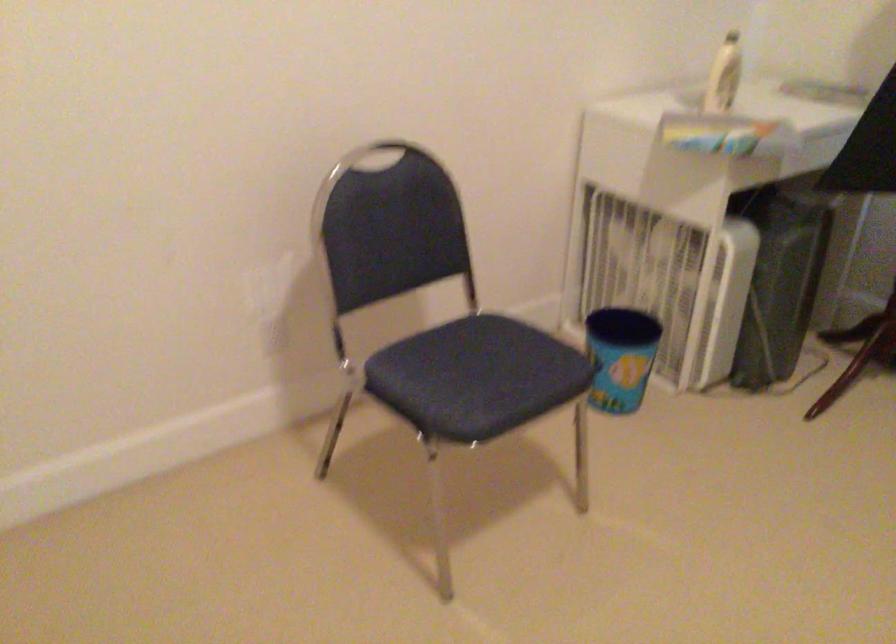
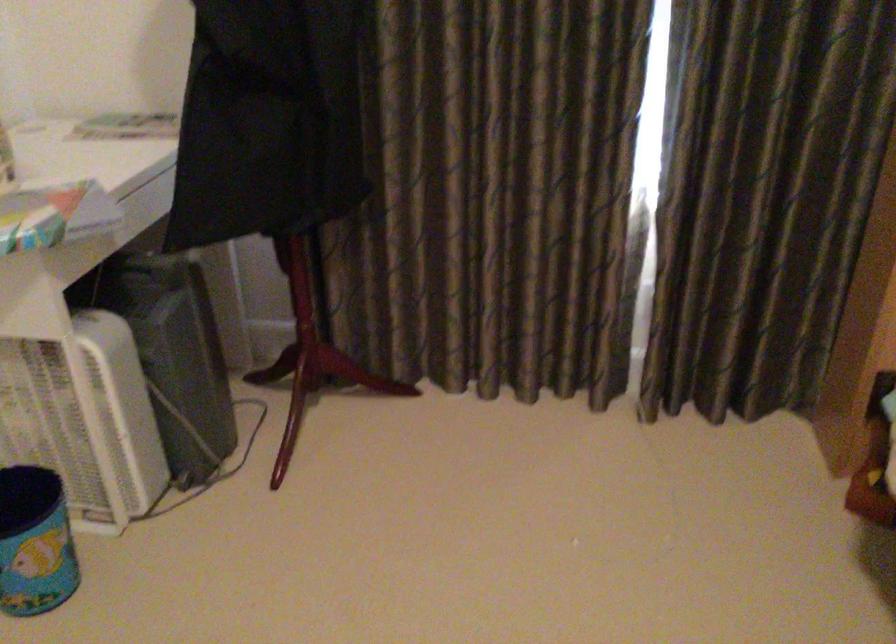
Find the pixel in the second image that matches point 698,289 in the first image.

(82, 413)